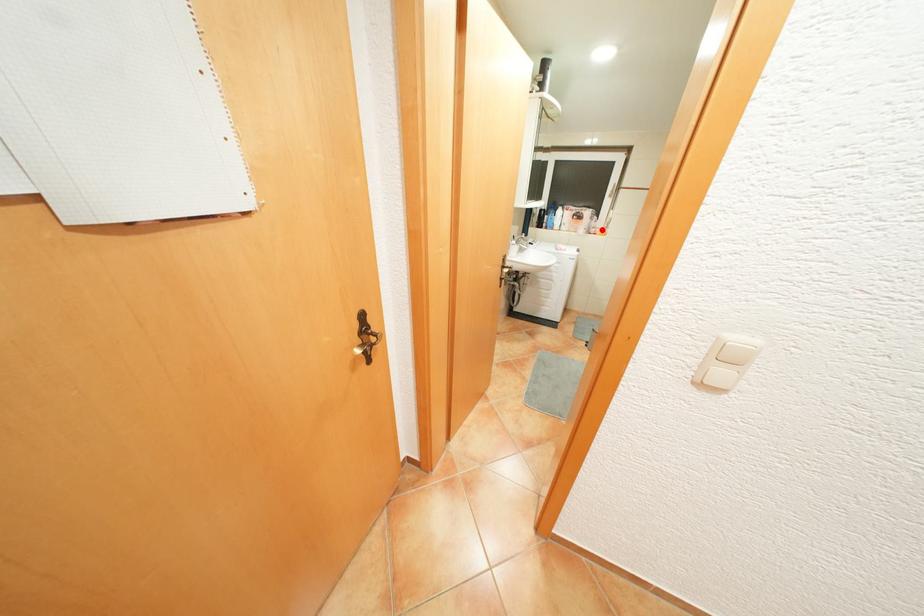
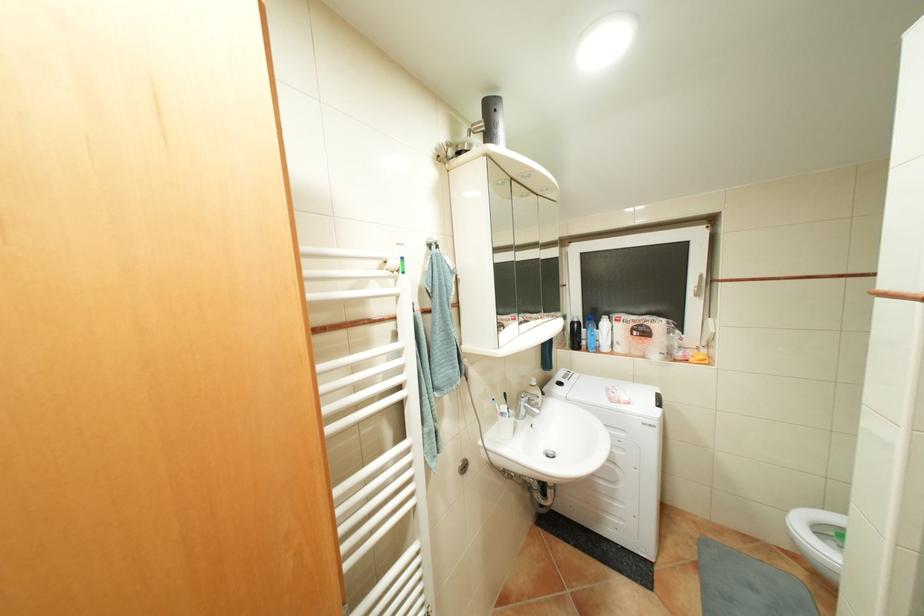
Question: A red point is marked in image1. In image2, is the corresponding 3D point closer to the camera or farther? Reply with the corresponding letter.

Choices:
 (A) The corresponding 3D point is closer.
 (B) The corresponding 3D point is farther.

Answer: (B)